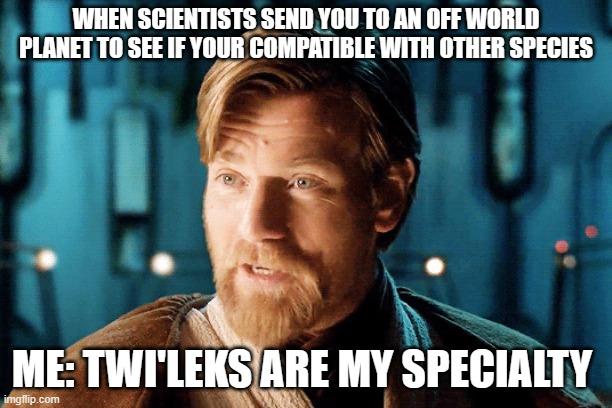
Locate an element on the screen. The height and width of the screenshot is (408, 612). lights is located at coordinates (45, 262), (165, 263), (431, 269), (562, 251), (591, 232).